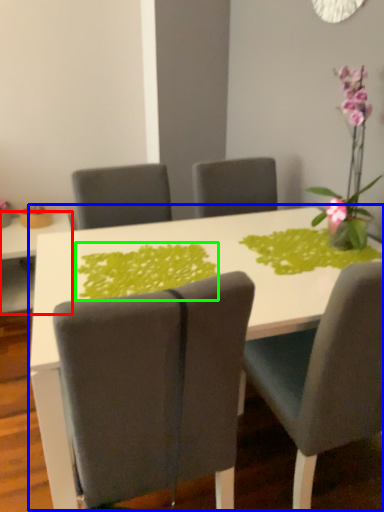
Question: Considering the real-world distances, which object is closest to table (highlighted by a red box)? table (highlighted by a blue box) or design (highlighted by a green box).

Choices:
 (A) table
 (B) design

Answer: (A)